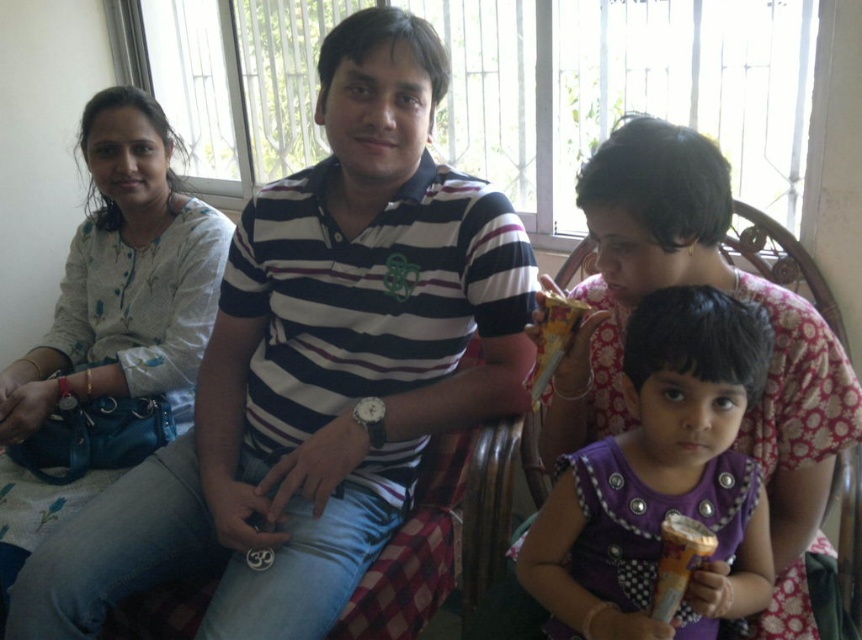
What do you see at coordinates (111, 326) in the screenshot? Image resolution: width=862 pixels, height=640 pixels. I see `white cotton shirt at left` at bounding box center [111, 326].

Which is behind, point (116, 104) or point (704, 600)?

The point (116, 104) is behind.

Which is behind, point (179, 376) or point (608, 580)?

The point (179, 376) is behind.

Where is `white cotton shirt at left`? This screenshot has height=640, width=862. white cotton shirt at left is located at coordinates (111, 326).

Can you confirm if purple satin dress at center is positioned below metallic gold ice cream cone at lower right?

Incorrect, purple satin dress at center is not positioned below metallic gold ice cream cone at lower right.

Is the position of purple satin dress at center less distant than that of metallic gold ice cream cone at lower right?

No.

Who is more distant from viewer, (606, 497) or (678, 525)?

The point (606, 497) is behind.

Locate an element on the screen. Image resolution: width=862 pixels, height=640 pixels. purple satin dress at center is located at coordinates (661, 481).

Does striped cotton shirt at center have a lesser height compared to metallic gold ice cream cone at lower right?

No.

Between striped cotton shirt at center and metallic gold ice cream cone at lower right, which one has more height?

striped cotton shirt at center

Image resolution: width=862 pixels, height=640 pixels. Describe the element at coordinates (315, 369) in the screenshot. I see `striped cotton shirt at center` at that location.

This screenshot has width=862, height=640. I want to click on striped cotton shirt at center, so click(315, 369).